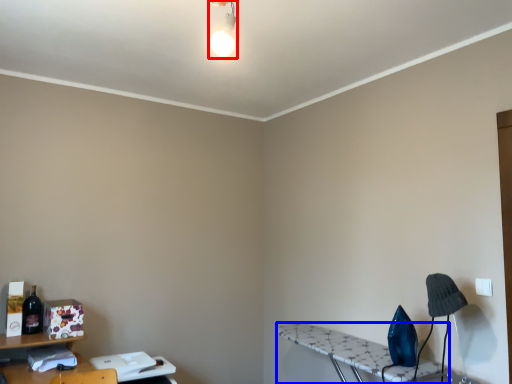
Question: Which object appears closest to the camera in this image, light fixture (highlighted by a red box) or table (highlighted by a blue box)?

Choices:
 (A) light fixture
 (B) table

Answer: (A)